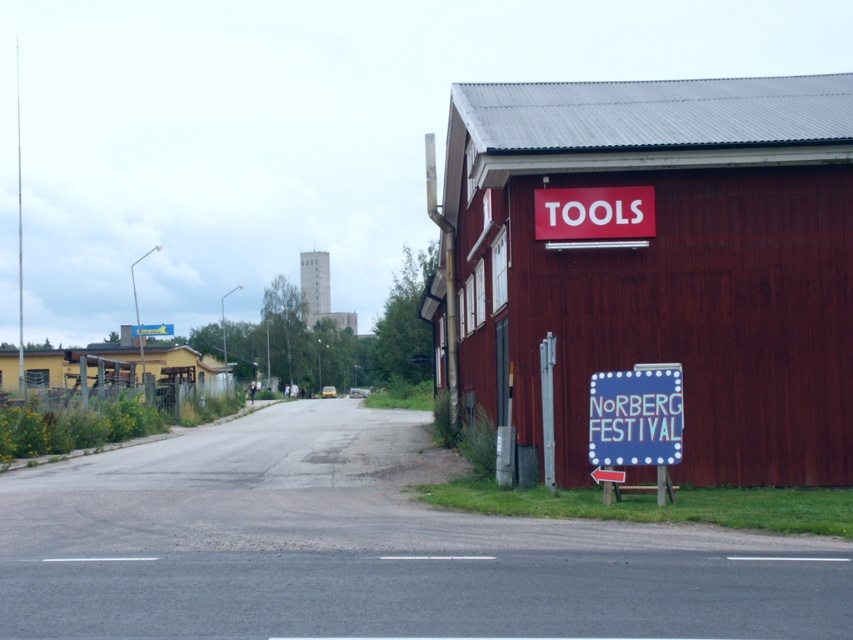
You are a tourist driving along the road towards the town. You see a yellow wood barn at left and a red matte tools at upper right. Which of these two landmarks is closer to your current position?

The yellow wood barn at left is closer to your current position because it is positioned to the left of the red matte tools at upper right, indicating it is nearer in the scene.

You are a delivery driver who needs to park your truck near the red wood barn at right without blocking the road. The red matte tools at upper right are obstacles. Can you park your truck between them?

The red wood barn at right might be wider than red matte tools at upper right. Since the red wood barn at right is wider, there is enough space between them to park the truck without blocking the road.

You are standing at the starting point of the road and want to reach the red wood barn at right. According to the coordinates provided, in which direction should you head?

The red wood barn at right is located at coordinates point (659, 266). Since you are at the starting point of the road, you should head towards the right direction to reach it.